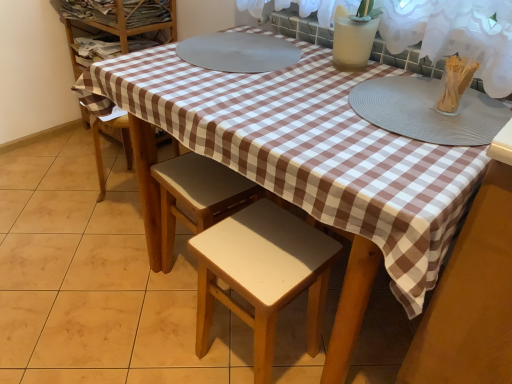
The image size is (512, 384). What are the coordinates of `free location in front of clear plastic container at upper right` in the screenshot? It's located at (455, 134).